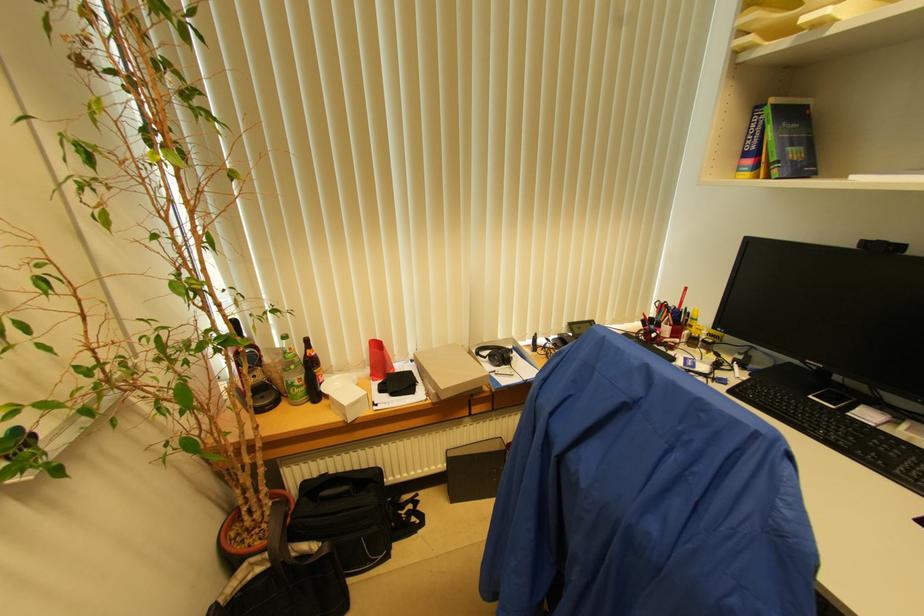
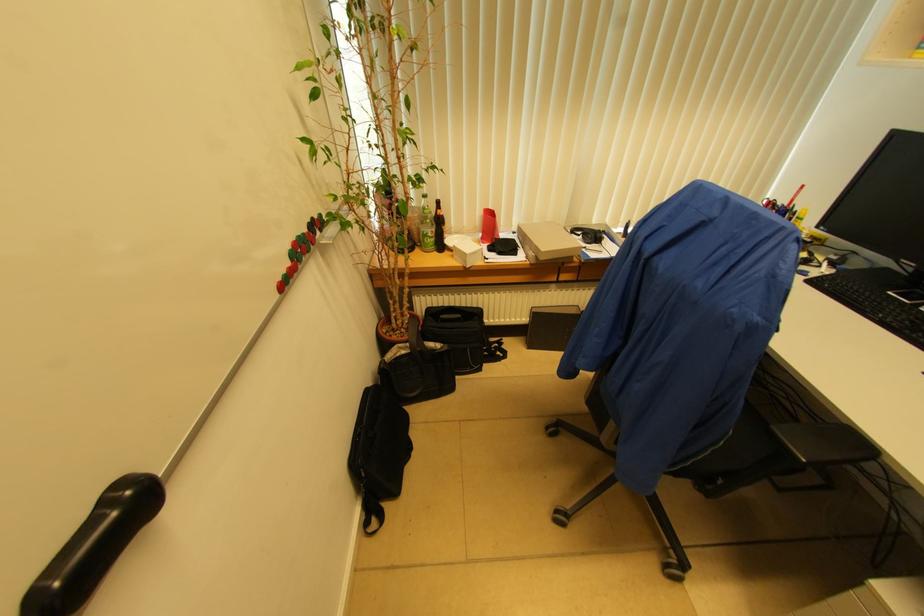
Where in the second image is the point corresponding to (x=689, y=315) from the first image?

(796, 215)